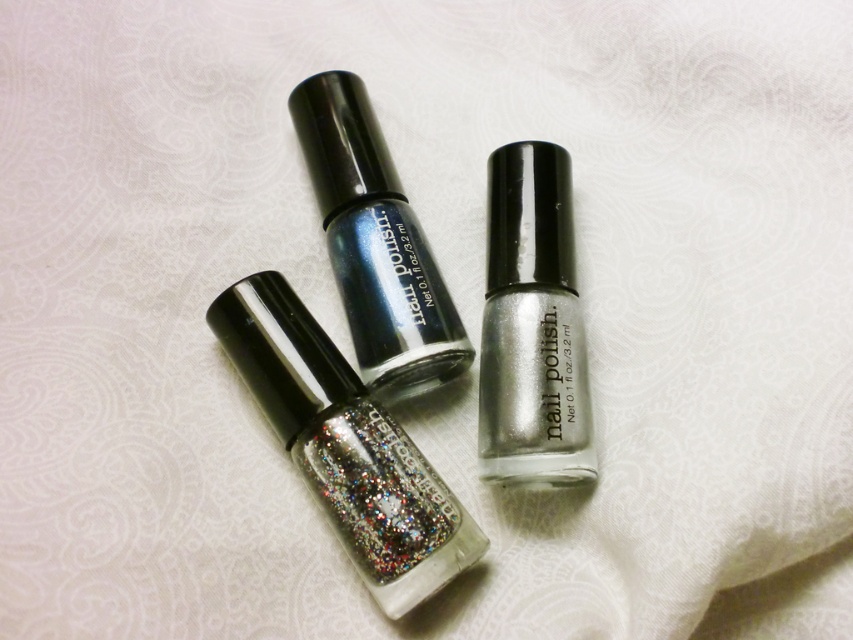
Is silver metallic nail polish at center closer to camera compared to metallic blue nail polish at center?

Yes.

Can you confirm if silver metallic nail polish at center is shorter than metallic blue nail polish at center?

No.

Is point (491, 237) behind point (361, 253)?

Yes.

Where is `silver metallic nail polish at center`? The image size is (853, 640). silver metallic nail polish at center is located at coordinates (532, 326).

Is glittery silver nail polish at center smaller than silver metallic nail polish at center?

No.

Locate an element on the screen. The height and width of the screenshot is (640, 853). glittery silver nail polish at center is located at coordinates (345, 445).

Does glittery silver nail polish at center have a smaller size compared to metallic blue nail polish at center?

No, glittery silver nail polish at center is not smaller than metallic blue nail polish at center.

Can you confirm if glittery silver nail polish at center is positioned to the right of metallic blue nail polish at center?

No, glittery silver nail polish at center is not to the right of metallic blue nail polish at center.

Is point (425, 564) farther from viewer compared to point (399, 216)?

No, it is not.

Where is `glittery silver nail polish at center`? This screenshot has width=853, height=640. glittery silver nail polish at center is located at coordinates (345, 445).